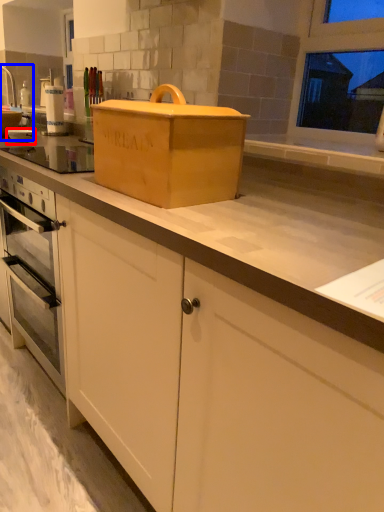
Question: Among these objects, which one is nearest to the camera, appliance (highlighted by a red box) or sink (highlighted by a blue box)?

Choices:
 (A) appliance
 (B) sink

Answer: (A)